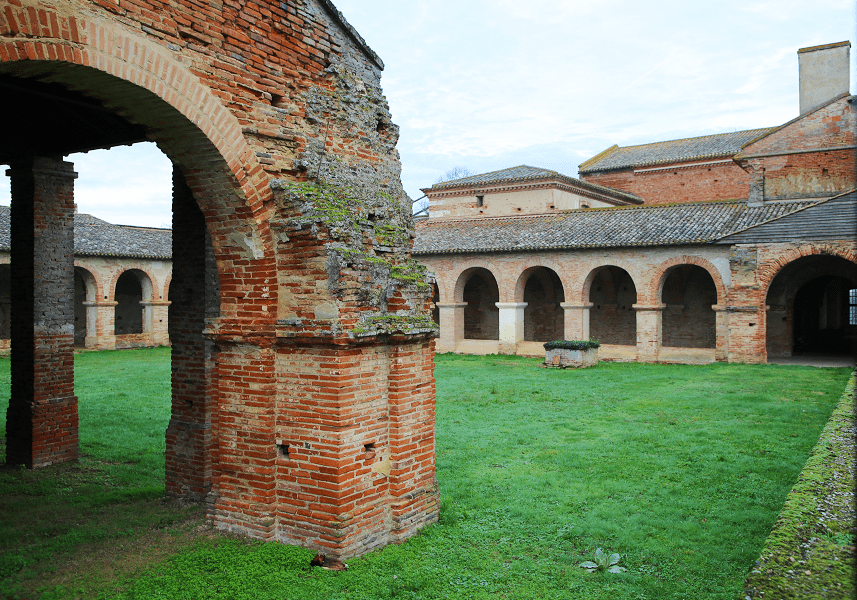
Where is `window in distance`? window in distance is located at coordinates coord(852,300).